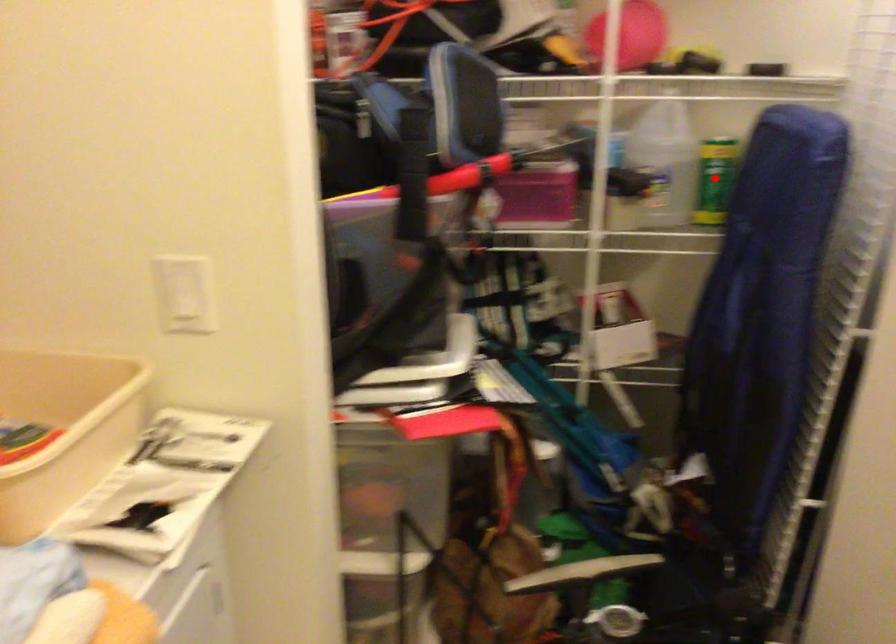
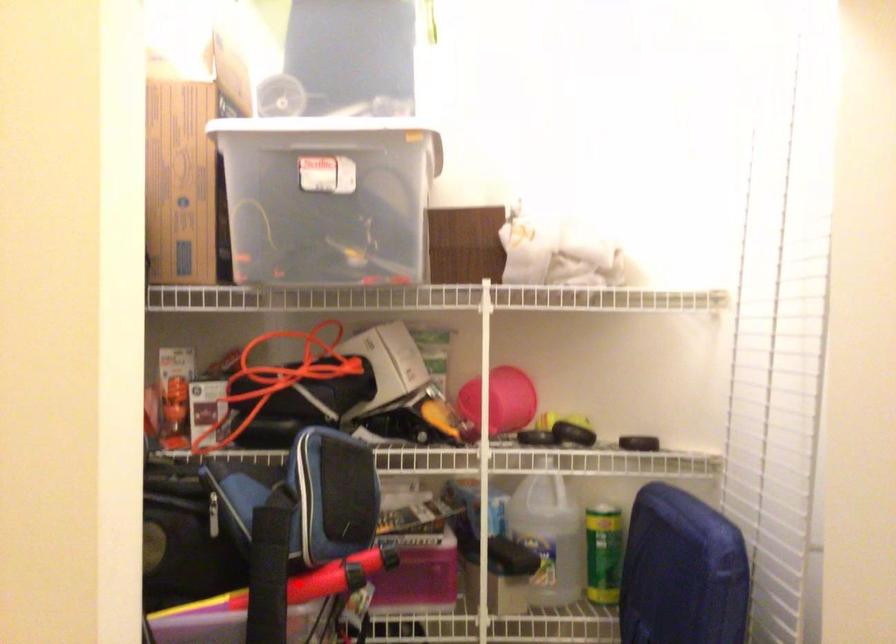
I am providing you with two images of the same scene from different viewpoints. A red point is marked on the first image and another point is marked on the second image. Is the red point in image1 aligned with the point shown in image2?

No